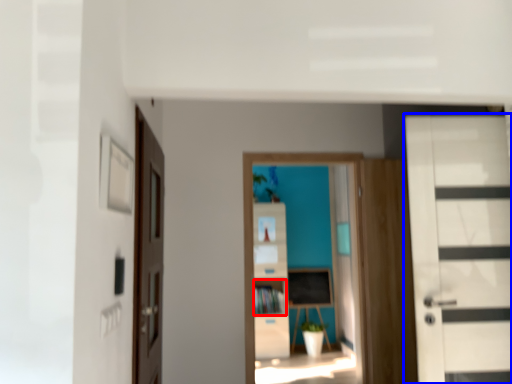
Question: Which point is further to the camera, cabinet (highlighted by a red box) or door (highlighted by a blue box)?

Choices:
 (A) cabinet
 (B) door

Answer: (A)